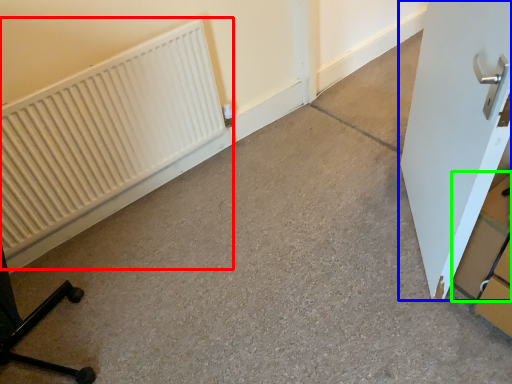
Question: Which object is the farthest from radiator (highlighted by a red box)? Choose among these: door (highlighted by a blue box) or cardboard box (highlighted by a green box).

Choices:
 (A) door
 (B) cardboard box

Answer: (B)